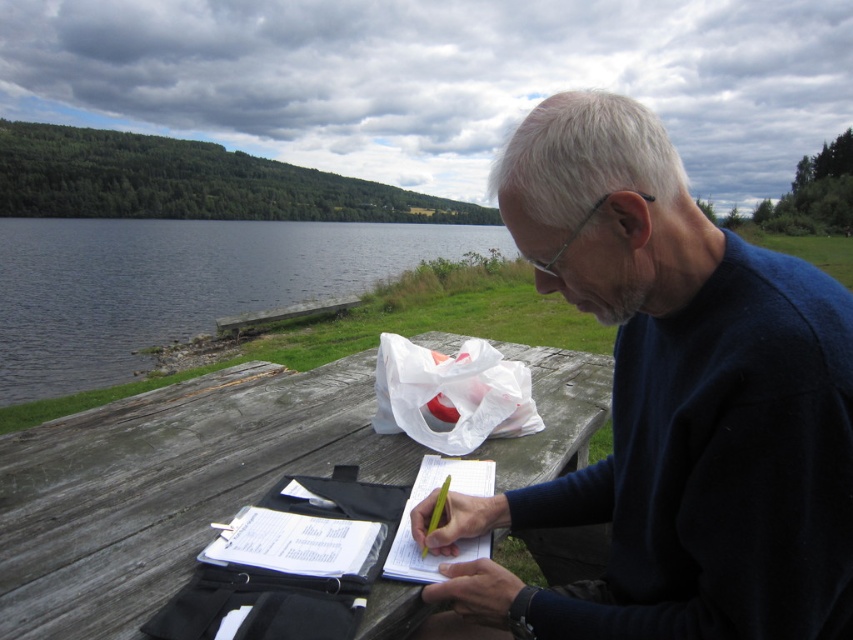
Question: Is weathered wood picnic table at center above smooth water at left?

Choices:
 (A) no
 (B) yes

Answer: (A)

Question: Which object is farther from the camera taking this photo?

Choices:
 (A) dark blue sweater at center
 (B) weathered wood picnic table at center
 (C) smooth water at left

Answer: (C)

Question: Does dark blue sweater at center come in front of weathered wood picnic table at center?

Choices:
 (A) yes
 (B) no

Answer: (A)

Question: Which point is farther to the camera?

Choices:
 (A) dark blue sweater at center
 (B) smooth water at left

Answer: (B)

Question: Among these objects, which one is farthest from the camera?

Choices:
 (A) weathered wood picnic table at center
 (B) smooth water at left

Answer: (B)

Question: Can you confirm if dark blue sweater at center is wider than smooth water at left?

Choices:
 (A) no
 (B) yes

Answer: (A)